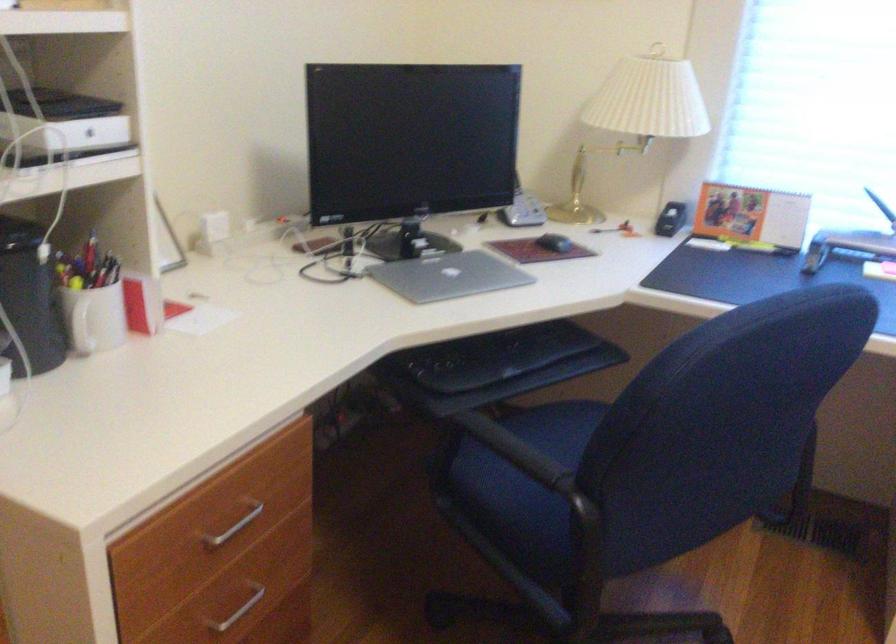
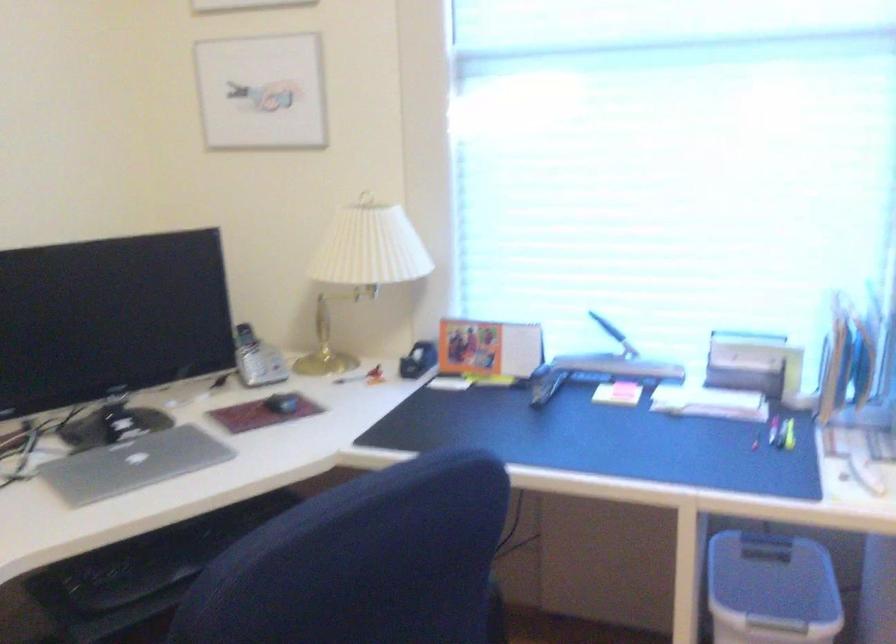
The point at (521,203) is marked in the first image. Where is the corresponding point in the second image?

(256, 359)